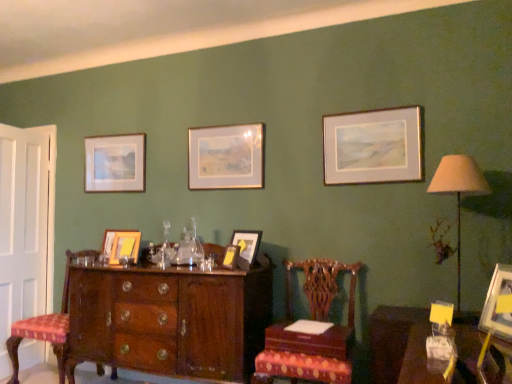
Question: From a real-world perspective, is matte gold picture frame at center, the 6th picture frame from the back, above or below matte gold picture frame at center, the 3th picture frame positioned from the right?

Choices:
 (A) below
 (B) above

Answer: (A)

Question: Based on their sizes in the image, would you say matte gold picture frame at center, positioned as the 4th picture frame in right-to-left order, is bigger or smaller than matte gold picture frame at center, the fourth picture frame viewed from the back?

Choices:
 (A) big
 (B) small

Answer: (B)

Question: Based on their relative distances, which object is nearer to the gold-framed painting at center, the 3th picture frame when ordered from left to right?

Choices:
 (A) matte silver picture frame at upper left, positioned as the 1th picture frame in back-to-front order
 (B) matte gold picture frame at center, the 6th picture frame from the back
 (C) wooden chair with upholstered seat at left, the 1th chair viewed from the back
 (D) beige fabric lampshade at right
 (E) wooden picture frame at lower right, which is the first picture frame in front-to-back order

Answer: (B)

Question: Estimate the real-world distances between objects in this image. Which object is farther from the matte gold picture frame at center, placed as the 4th picture frame when sorted from front to back?

Choices:
 (A) wooden picture frame at center, which appears as the 2th picture frame when viewed from the back
 (B) mahogany wooden chest of drawers at center
 (C) mahogany wood chair at center, placed as the 2th chair when sorted from back to front
 (D) gold metallic picture frame at upper right, arranged as the 5th picture frame when viewed from the back
 (E) white wood door at left

Answer: (E)